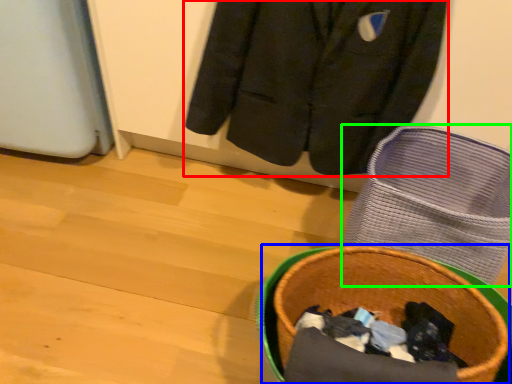
Question: Which object is the closest to the jacket (highlighted by a red box)? Choose among these: basket container (highlighted by a blue box) or footwear (highlighted by a green box).

Choices:
 (A) basket container
 (B) footwear

Answer: (B)